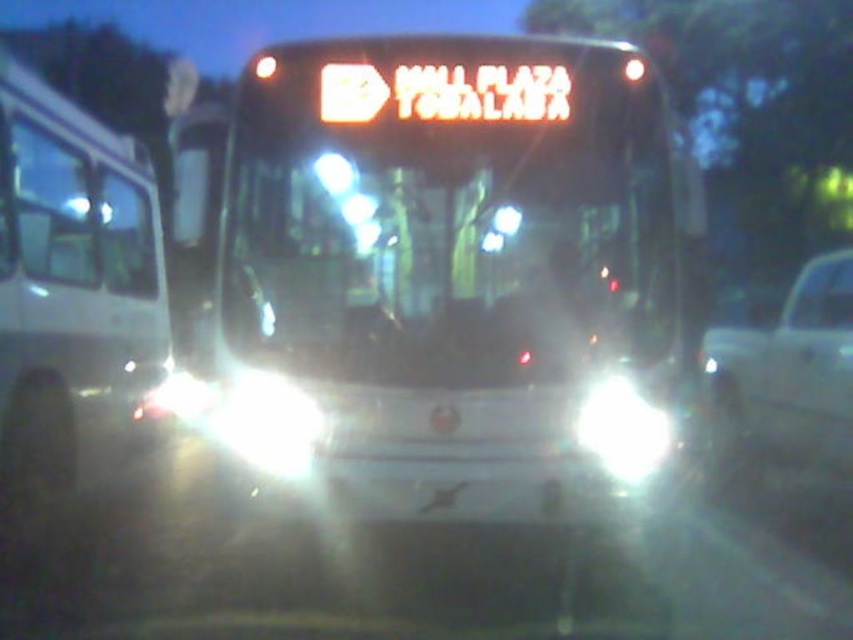
Question: Considering the real-world distances, which object is farthest from the white glossy bus at left?

Choices:
 (A) white glossy car at right
 (B) transparent glass windshield at center

Answer: (A)

Question: Is white glossy bus at left positioned behind white glossy car at right?

Choices:
 (A) yes
 (B) no

Answer: (B)

Question: Does white glossy bus at left appear on the left side of white glossy headlight at center?

Choices:
 (A) no
 (B) yes

Answer: (B)

Question: From the image, what is the correct spatial relationship of transparent glass windshield at center in relation to white glossy headlight at center?

Choices:
 (A) left
 (B) right

Answer: (A)

Question: Which object appears farthest from the camera in this image?

Choices:
 (A) white glossy bus at center
 (B) transparent glass windshield at center
 (C) white glossy bus at left
 (D) white glossy headlight at center

Answer: (C)

Question: Estimate the real-world distances between objects in this image. Which object is closer to the white glossy bus at left?

Choices:
 (A) white glossy headlight at center
 (B) white glossy bus at center
 (C) transparent glass windshield at center

Answer: (B)